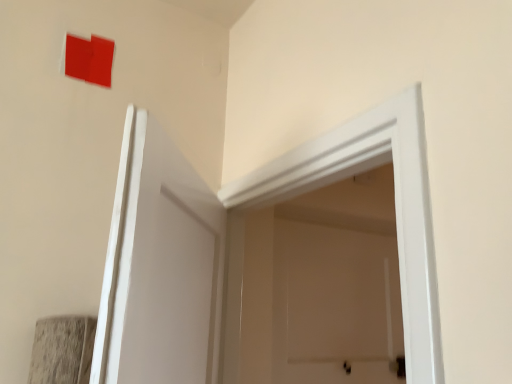
Find the location of `matte red square at upper left`. matte red square at upper left is located at coordinates (89, 59).

Image resolution: width=512 pixels, height=384 pixels. What do you see at coordinates (89, 59) in the screenshot? I see `matte red square at upper left` at bounding box center [89, 59].

I want to click on white smooth door at center, so click(x=243, y=247).

This screenshot has height=384, width=512. What do you see at coordinates (243, 247) in the screenshot?
I see `white smooth door at center` at bounding box center [243, 247].

I want to click on matte red square at upper left, so click(89, 59).

Is white smooth door at center to the left or to the right of matte red square at upper left in the image?

In the image, white smooth door at center appears on the right side of matte red square at upper left.

Which object is more forward, white smooth door at center or matte red square at upper left?

Positioned in front is white smooth door at center.

Which point is more distant from viewer, (376, 118) or (84, 67)?

The point (84, 67) is more distant.

Looking at this image, from the image's perspective, is white smooth door at center positioned above or below matte red square at upper left?

Clearly, from the image's perspective, white smooth door at center is below matte red square at upper left.

From a real-world perspective, is white smooth door at center physically above matte red square at upper left?

No.

Between white smooth door at center and matte red square at upper left, which one has larger width?

white smooth door at center.

Which of these two, white smooth door at center or matte red square at upper left, stands taller?

white smooth door at center is taller.

Based on their sizes in the image, would you say white smooth door at center is bigger or smaller than matte red square at upper left?

In the image, white smooth door at center appears to be larger than matte red square at upper left.

Is white smooth door at center situated inside matte red square at upper left or outside?

white smooth door at center exists outside the volume of matte red square at upper left.

Is white smooth door at center placed right next to matte red square at upper left?

No.

Is white smooth door at center looking in the opposite direction of matte red square at upper left?

No.

Measure the distance from white smooth door at center to matte red square at upper left.

white smooth door at center and matte red square at upper left are 31.29 inches apart from each other.

Where is `square above the white smooth door at center (from the image's perspective)`? square above the white smooth door at center (from the image's perspective) is located at coordinates (89, 59).

Considering the relative positions of matte red square at upper left and white smooth door at center in the image provided, is matte red square at upper left to the right of white smooth door at center from the viewer's perspective?

No.

Based on the photo, is matte red square at upper left further to the viewer compared to white smooth door at center?

Yes, the depth of matte red square at upper left is greater than that of white smooth door at center.

Is point (91, 79) positioned before point (279, 164)?

No.

From the image's perspective, is matte red square at upper left above or below white smooth door at center?

Based on their image positions, matte red square at upper left is located above white smooth door at center.

From a real-world perspective, which is physically below, matte red square at upper left or white smooth door at center?

From a 3D spatial view, white smooth door at center is below.

Looking at their sizes, would you say matte red square at upper left is wider or thinner than white smooth door at center?

matte red square at upper left is thinner than white smooth door at center.

Between matte red square at upper left and white smooth door at center, which one has less height?

matte red square at upper left is shorter.

Who is smaller, matte red square at upper left or white smooth door at center?

Smaller between the two is matte red square at upper left.

Is matte red square at upper left completely or partially outside of white smooth door at center?

Yes, matte red square at upper left is outside of white smooth door at center.

Is matte red square at upper left beside white smooth door at center?

matte red square at upper left and white smooth door at center are clearly separated.

Is matte red square at upper left facing away from white smooth door at center?

That's not correct — matte red square at upper left is not looking away from white smooth door at center.

Based on the photo, what's the angular difference between matte red square at upper left and white smooth door at center's facing directions?

matte red square at upper left and white smooth door at center are facing 92.1 degrees away from each other.

At what (x,y) coordinates should I click in order to perform the action: click on square above the white smooth door at center (from a real-world perspective). Please return your answer as a coordinate pair (x, y). Image resolution: width=512 pixels, height=384 pixels. Looking at the image, I should click on (89, 59).

Identify the location of door in front of the matte red square at upper left. (243, 247).

Find the location of `square behind the white smooth door at center`. square behind the white smooth door at center is located at coordinates 89,59.